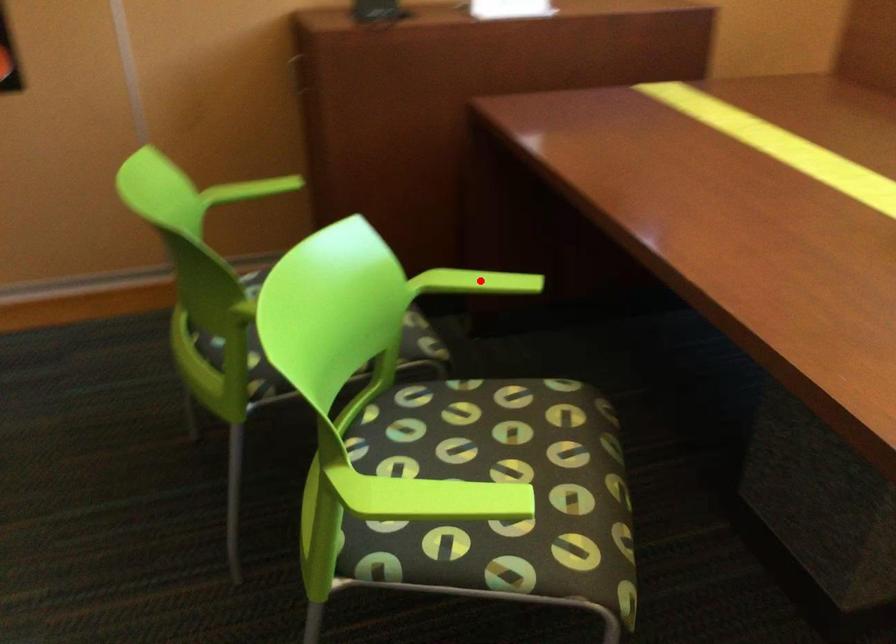
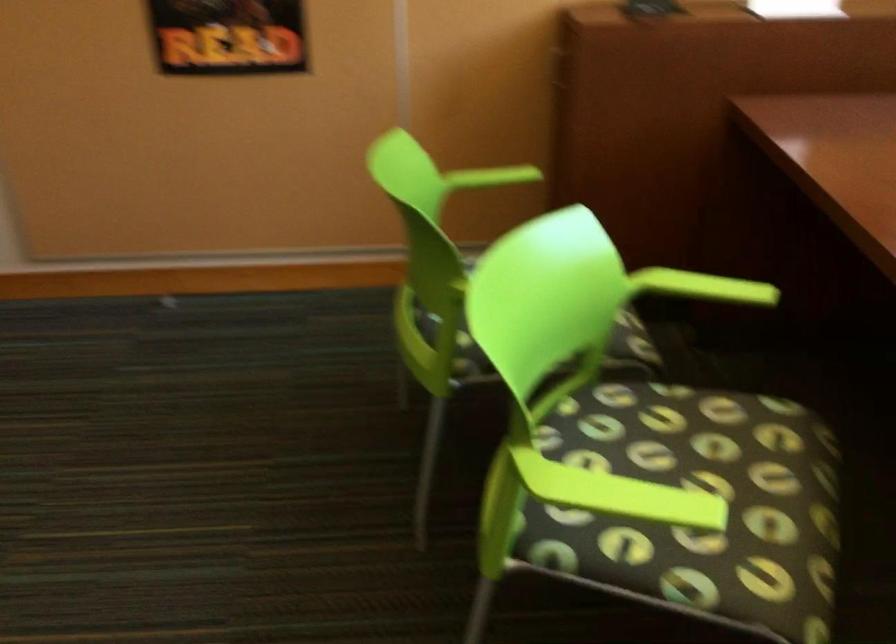
The point at the highlighted location is marked in the first image. Where is the corresponding point in the second image?

(702, 287)